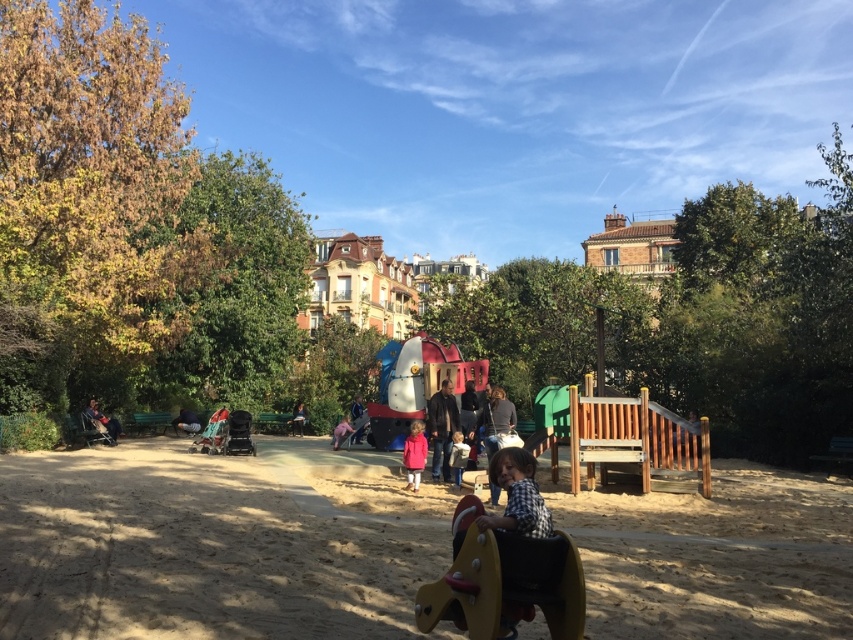
Can you confirm if pink matte jacket at center is wider than dark gray fabric stroller at left?

Correct, the width of pink matte jacket at center exceeds that of dark gray fabric stroller at left.

In the scene shown: Is pink matte jacket at center thinner than dark gray fabric stroller at left?

No.

Is point (354, 406) positioned behind point (183, 426)?

Yes, it is behind point (183, 426).

The height and width of the screenshot is (640, 853). I want to click on pink matte jacket at center, so click(x=358, y=419).

Is brown sandy playground at center smaller than matte pink coat at center?

No, brown sandy playground at center is not smaller than matte pink coat at center.

Is brown sandy playground at center taller than matte pink coat at center?

In fact, brown sandy playground at center may be shorter than matte pink coat at center.

Between point (320, 621) and point (415, 444), which one is positioned in front?

Point (320, 621) is in front.

Where is `brown sandy playground at center`? The height and width of the screenshot is (640, 853). brown sandy playground at center is located at coordinates (213, 544).

Does pink matte jacket at center appear on the right side of pink fabric person at center?

Correct, you'll find pink matte jacket at center to the right of pink fabric person at center.

Who is more forward, (x=361, y=426) or (x=338, y=422)?

Point (x=361, y=426) is more forward.

The height and width of the screenshot is (640, 853). In order to click on pink matte jacket at center in this screenshot , I will do `click(358, 419)`.